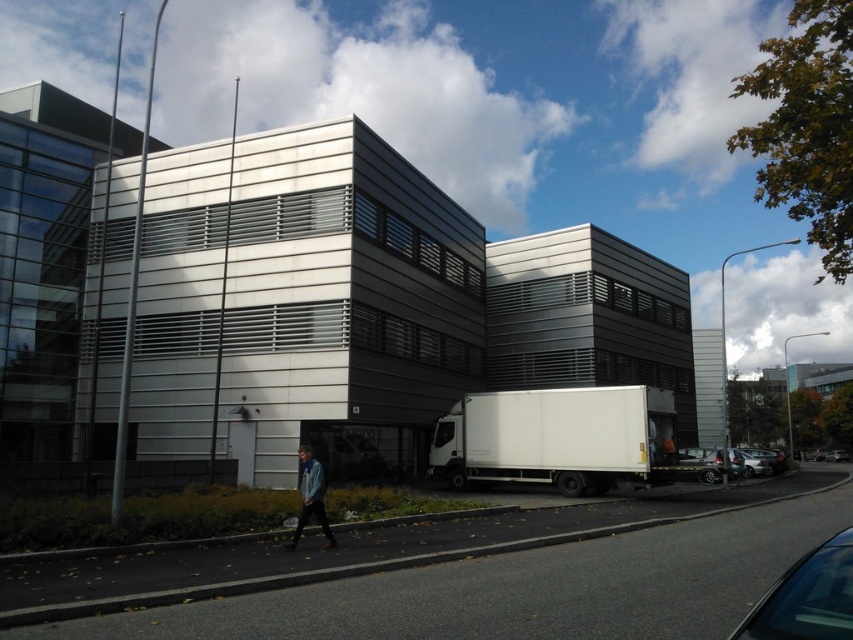
Between white matte trailer truck at center and metallic silver sedan at lower right, which one is positioned lower?

metallic silver sedan at lower right is lower down.

Is the position of white matte trailer truck at center less distant than that of metallic silver sedan at lower right?

Yes, white matte trailer truck at center is in front of metallic silver sedan at lower right.

Is point (460, 428) in front of point (769, 451)?

Yes, point (460, 428) is in front of point (769, 451).

This screenshot has height=640, width=853. In order to click on white matte trailer truck at center in this screenshot , I will do `click(556, 438)`.

Measure the distance between denim jacket at lower center and camera.

10.19 meters

Does denim jacket at lower center have a larger size compared to metallic silver sedan at lower right?

No.

Does point (312, 492) come behind point (785, 468)?

No.

Identify the location of denim jacket at lower center. The width and height of the screenshot is (853, 640). [310, 497].

Based on the photo, between white matte trailer truck at center and denim jacket at lower center, which one is positioned lower?

Positioned lower is white matte trailer truck at center.

How far apart are white matte trailer truck at center and denim jacket at lower center?

white matte trailer truck at center and denim jacket at lower center are 8.33 meters apart from each other.

The width and height of the screenshot is (853, 640). What do you see at coordinates (556, 438) in the screenshot?
I see `white matte trailer truck at center` at bounding box center [556, 438].

Locate an element on the screen. The image size is (853, 640). white matte trailer truck at center is located at coordinates (556, 438).